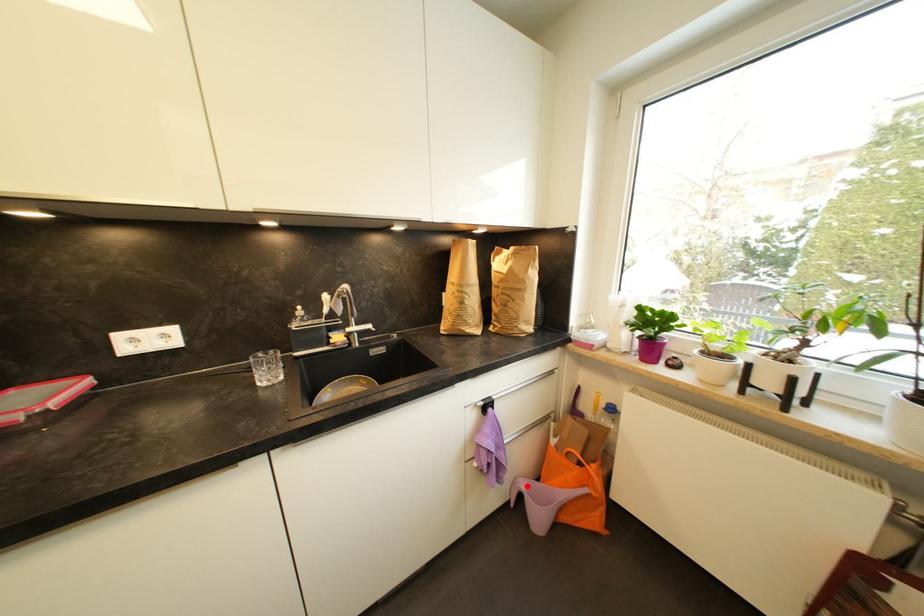
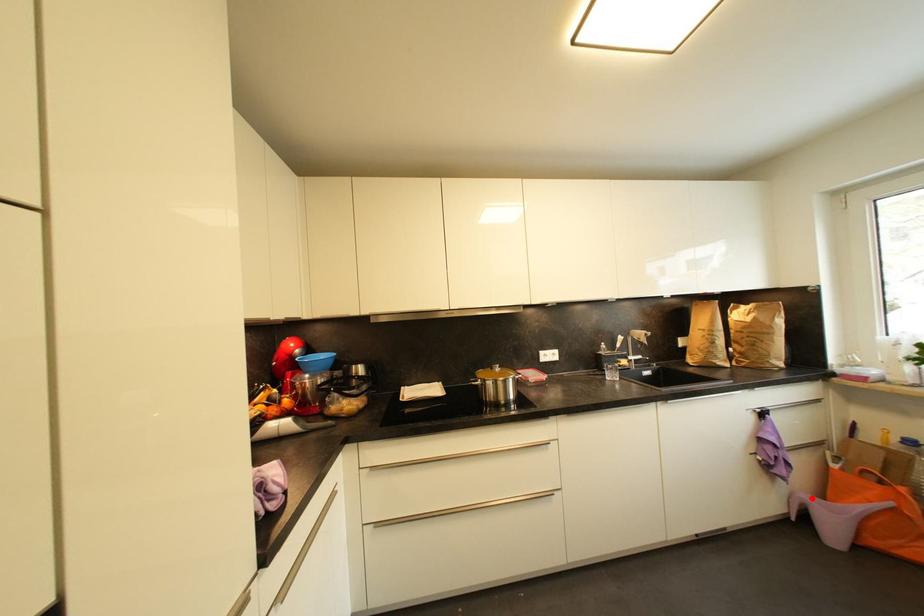
I am providing you with two images of the same scene from different viewpoints. A red point is marked on the first image and another point is marked on the second image. Is the red point in image1 aligned with the point shown in image2?

Yes